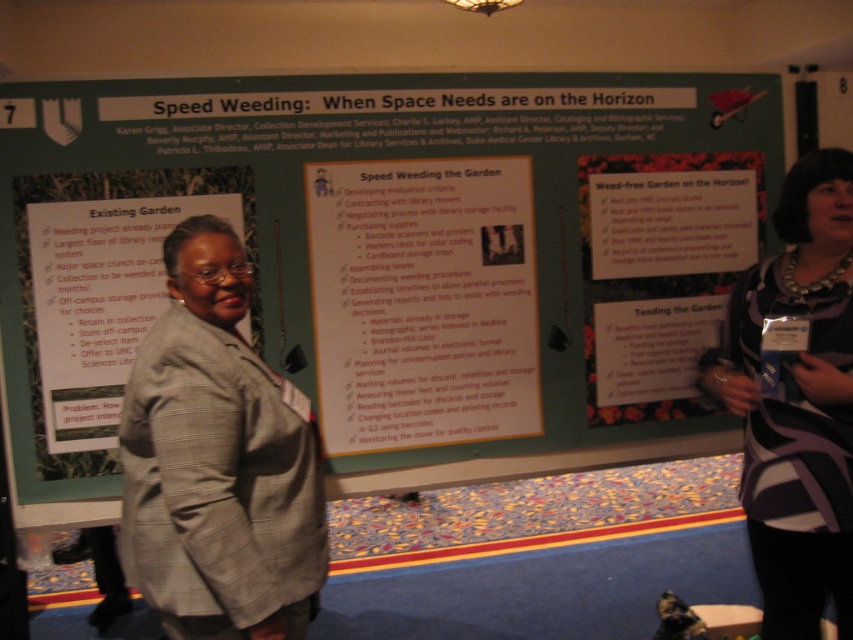
Question: Where is green matte poster at center located in relation to orange paper poster at center in the image?

Choices:
 (A) above
 (B) below

Answer: (A)

Question: Does green matte poster at center have a greater width compared to orange paper poster at center?

Choices:
 (A) yes
 (B) no

Answer: (A)

Question: Considering the real-world distances, which object is farthest from the orange paper poster at center?

Choices:
 (A) green matte poster at center
 (B) striped fabric dress at center

Answer: (B)

Question: Is the position of orange paper poster at center more distant than that of white paper poster at center?

Choices:
 (A) yes
 (B) no

Answer: (A)

Question: Based on their relative distances, which object is nearer to the striped fabric dress at center?

Choices:
 (A) gray plaid blazer at center
 (B) orange paper poster at center

Answer: (B)

Question: Which object is closer to the camera taking this photo?

Choices:
 (A) white paper poster at center
 (B) orange paper poster at center
 (C) striped fabric dress at center
 (D) green matte poster at center

Answer: (C)